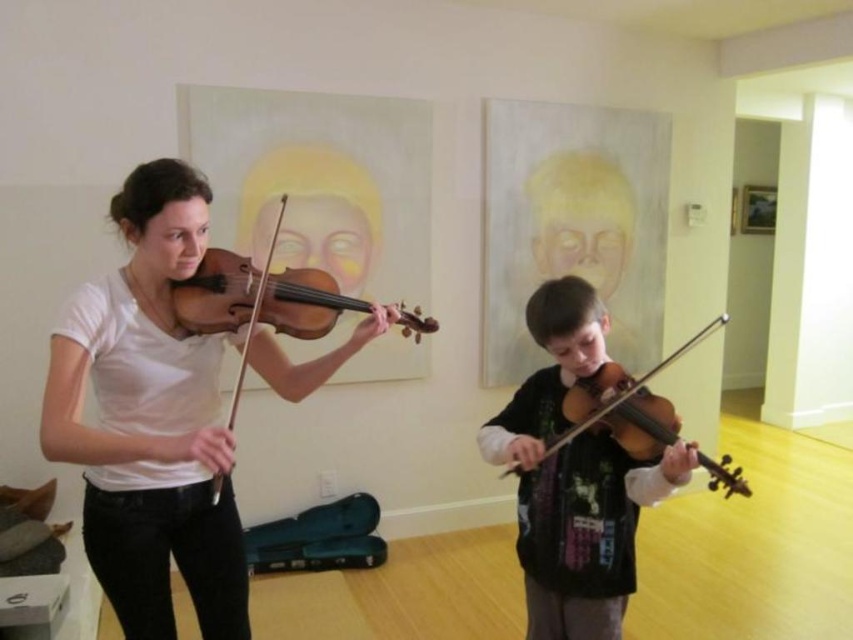
Question: Which point is closer to the camera?

Choices:
 (A) matte black violin at center
 (B) wooden violin at lower center

Answer: (B)

Question: Among these points, which one is nearest to the camera?

Choices:
 (A) (108, 380)
 (B) (608, 556)

Answer: (A)

Question: Can you confirm if matte white violin at left is positioned above wooden violin at center?

Choices:
 (A) no
 (B) yes

Answer: (A)

Question: From the image, what is the correct spatial relationship of matte black violin at center in relation to wooden violin at center?

Choices:
 (A) below
 (B) above

Answer: (A)

Question: Is matte black violin at center bigger than wooden violin at lower center?

Choices:
 (A) yes
 (B) no

Answer: (A)

Question: Which point is farther from the camera taking this photo?

Choices:
 (A) (279, 221)
 (B) (668, 432)
 (C) (669, 464)
 (D) (91, 291)

Answer: (A)